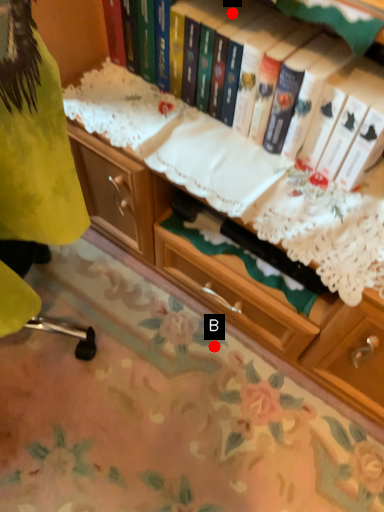
Question: Two points are circled on the image, labeled by A and B beside each circle. Which point appears closest to the camera in this image?

Choices:
 (A) A is closer
 (B) B is closer

Answer: (A)